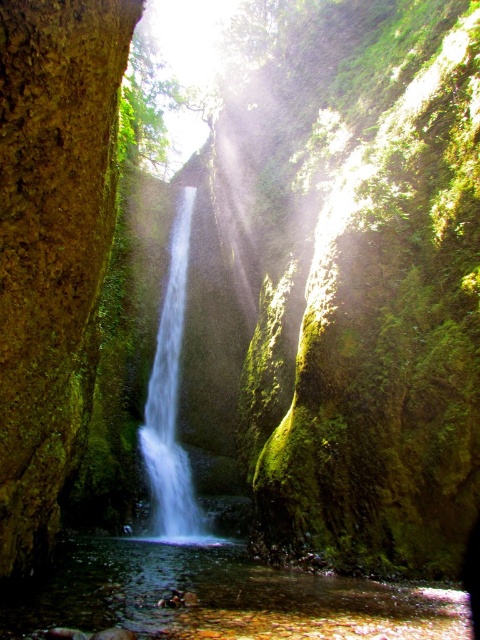
Is clear water at center taller than white smooth waterfall at center?

In fact, clear water at center may be shorter than white smooth waterfall at center.

Can you confirm if clear water at center is thinner than white smooth waterfall at center?

In fact, clear water at center might be wider than white smooth waterfall at center.

Between point (394, 609) and point (156, 516), which one is positioned in front?

Point (394, 609)

Image resolution: width=480 pixels, height=640 pixels. What are the coordinates of `clear water at center` in the screenshot? It's located at (224, 596).